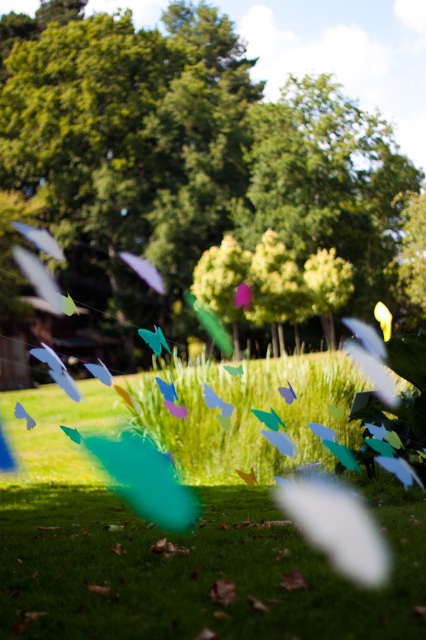
Question: Which object appears closest to the camera in this image?

Choices:
 (A) green matte grass at center
 (B) green leafy tree at center

Answer: (A)

Question: Does green leafy tree at center appear over green matte grass at center?

Choices:
 (A) no
 (B) yes

Answer: (B)

Question: Is green leafy tree at center to the right of green matte grass at center from the viewer's perspective?

Choices:
 (A) yes
 (B) no

Answer: (A)

Question: Does green leafy tree at center appear over green matte grass at center?

Choices:
 (A) yes
 (B) no

Answer: (A)

Question: Among these objects, which one is farthest from the camera?

Choices:
 (A) green matte grass at center
 (B) green leafy tree at center

Answer: (B)